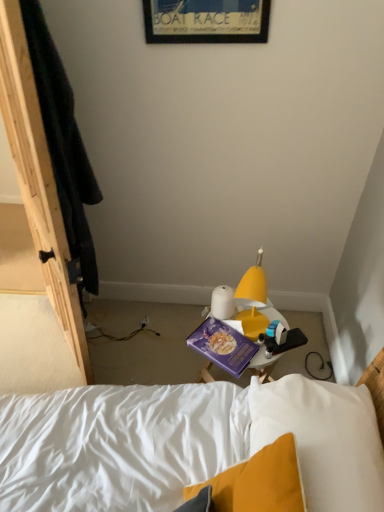
Question: Does wooden framed poster at upper center have a greater height compared to purple matte paperback book at center?

Choices:
 (A) no
 (B) yes

Answer: (B)

Question: Is wooden framed poster at upper center completely or partially outside of purple matte paperback book at center?

Choices:
 (A) no
 (B) yes

Answer: (B)

Question: Considering the relative sizes of wooden framed poster at upper center and purple matte paperback book at center in the image provided, is wooden framed poster at upper center smaller than purple matte paperback book at center?

Choices:
 (A) no
 (B) yes

Answer: (A)

Question: From the image's perspective, is wooden framed poster at upper center under purple matte paperback book at center?

Choices:
 (A) no
 (B) yes

Answer: (A)

Question: Are wooden framed poster at upper center and purple matte paperback book at center making contact?

Choices:
 (A) yes
 (B) no

Answer: (B)

Question: Is wooden framed poster at upper center wider than purple matte paperback book at center?

Choices:
 (A) yes
 (B) no

Answer: (B)

Question: Is wooden framed poster at upper center completely or partially inside purple matte paperback book at center?

Choices:
 (A) no
 (B) yes

Answer: (A)

Question: Does purple matte paperback book at center lie behind wooden framed poster at upper center?

Choices:
 (A) yes
 (B) no

Answer: (A)

Question: Is purple matte paperback book at center oriented away from wooden framed poster at upper center?

Choices:
 (A) no
 (B) yes

Answer: (A)

Question: Can you confirm if purple matte paperback book at center is shorter than wooden framed poster at upper center?

Choices:
 (A) no
 (B) yes

Answer: (B)

Question: Is purple matte paperback book at center positioned far away from wooden framed poster at upper center?

Choices:
 (A) yes
 (B) no

Answer: (A)

Question: Can you confirm if purple matte paperback book at center is positioned to the right of wooden framed poster at upper center?

Choices:
 (A) yes
 (B) no

Answer: (A)

Question: From a real-world perspective, is wooden framed poster at upper center positioned above or below purple matte paperback book at center?

Choices:
 (A) below
 (B) above

Answer: (B)